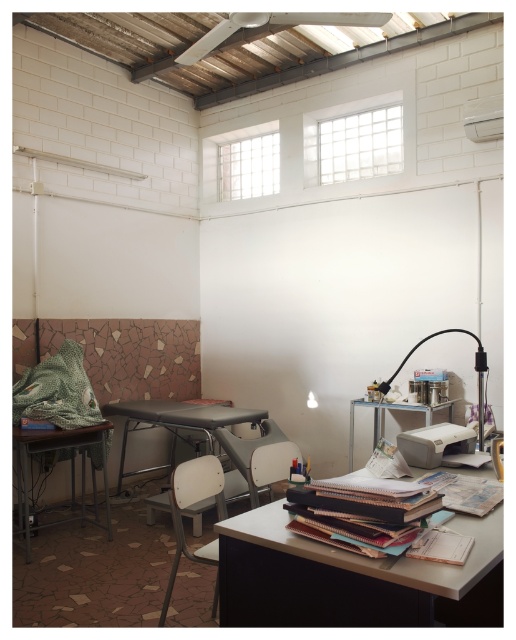
Question: Estimate the real-world distances between objects in this image. Which object is closer to the transparent plastic lamp at upper right?

Choices:
 (A) metallic gray table at center
 (B) white grid window at upper center
 (C) metallic gray table at lower left
 (D) white plastic table at center

Answer: (D)

Question: Is white grid window at upper center bigger than transparent plastic lamp at upper right?

Choices:
 (A) yes
 (B) no

Answer: (B)

Question: Can you confirm if white plastic chair at lower center is smaller than clear glass window at upper center?

Choices:
 (A) yes
 (B) no

Answer: (B)

Question: Which point is closer to the camera taking this photo?

Choices:
 (A) (379, 388)
 (B) (382, 561)

Answer: (B)

Question: Based on their relative distances, which object is nearer to the white plastic chair at lower center?

Choices:
 (A) transparent plastic lamp at upper right
 (B) clear glass window at upper center
 (C) metallic gray table at lower left

Answer: (C)

Question: Is metallic gray table at center below white plastic table at center?

Choices:
 (A) no
 (B) yes

Answer: (B)